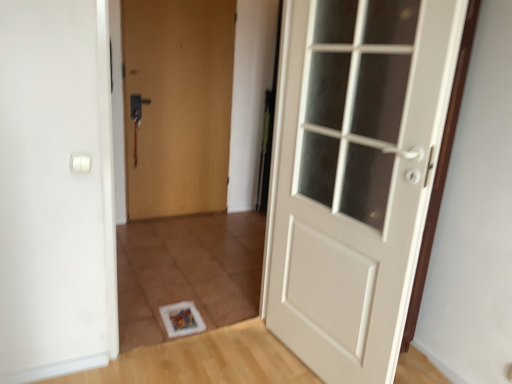
Locate an element on the screen. vacant space to the right of matte wood door at center, which is the 1th door from back to front is located at coordinates (223, 224).